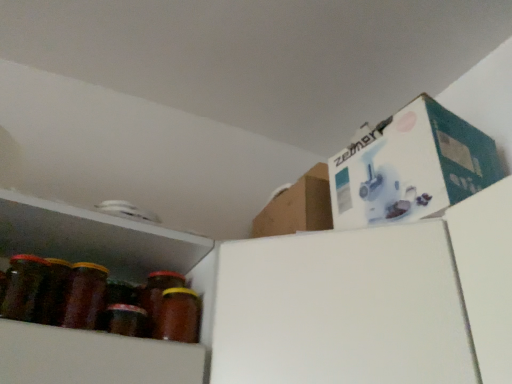
Question: From the image's perspective, is brown glass jar at lower left, the 2th bottle positioned from the left, on top of shiny brown glass jar at left, which is the 2th bottle in right-to-left order?

Choices:
 (A) yes
 (B) no

Answer: (B)

Question: Can you confirm if brown glass jar at lower left, acting as the first bottle starting from the right, is bigger than shiny brown glass jar at left, marked as the 1th bottle in a left-to-right arrangement?

Choices:
 (A) no
 (B) yes

Answer: (A)

Question: Is the depth of brown glass jar at lower left, acting as the first bottle starting from the right, greater than that of shiny brown glass jar at left, marked as the 1th bottle in a left-to-right arrangement?

Choices:
 (A) no
 (B) yes

Answer: (B)

Question: From a real-world perspective, is brown glass jar at lower left, acting as the first bottle starting from the right, beneath shiny brown glass jar at left, marked as the 1th bottle in a left-to-right arrangement?

Choices:
 (A) no
 (B) yes

Answer: (A)

Question: Would you consider brown glass jar at lower left, the 2th bottle positioned from the left, to be distant from shiny brown glass jar at left, which is the 2th bottle in right-to-left order?

Choices:
 (A) no
 (B) yes

Answer: (A)

Question: Is brown glass jar at lower left, acting as the first bottle starting from the right, next to shiny brown glass jar at left, marked as the 1th bottle in a left-to-right arrangement, and touching it?

Choices:
 (A) yes
 (B) no

Answer: (B)

Question: Considering the relative positions of shiny brown glass jar at left, which is the 2th bottle in right-to-left order, and brown glass jar at lower left, the 2th bottle positioned from the left, in the image provided, is shiny brown glass jar at left, which is the 2th bottle in right-to-left order, to the left of brown glass jar at lower left, the 2th bottle positioned from the left, from the viewer's perspective?

Choices:
 (A) no
 (B) yes

Answer: (B)

Question: Can you confirm if shiny brown glass jar at left, marked as the 1th bottle in a left-to-right arrangement, is thinner than brown glass jar at lower left, the 2th bottle positioned from the left?

Choices:
 (A) yes
 (B) no

Answer: (B)

Question: Is shiny brown glass jar at left, marked as the 1th bottle in a left-to-right arrangement, closer to camera compared to brown glass jar at lower left, acting as the first bottle starting from the right?

Choices:
 (A) yes
 (B) no

Answer: (A)

Question: Does shiny brown glass jar at left, which is the 2th bottle in right-to-left order, have a smaller size compared to brown glass jar at lower left, acting as the first bottle starting from the right?

Choices:
 (A) no
 (B) yes

Answer: (A)

Question: Is shiny brown glass jar at left, marked as the 1th bottle in a left-to-right arrangement, further to the viewer compared to brown glass jar at lower left, the 2th bottle positioned from the left?

Choices:
 (A) yes
 (B) no

Answer: (B)

Question: From a real-world perspective, is shiny brown glass jar at left, which is the 2th bottle in right-to-left order, physically above brown glass jar at lower left, the 2th bottle positioned from the left?

Choices:
 (A) yes
 (B) no

Answer: (B)

Question: Visually, is brown glass jar at lower left, the 2th bottle positioned from the left, positioned to the left or to the right of shiny brown glass jar at left, marked as the 1th bottle in a left-to-right arrangement?

Choices:
 (A) right
 (B) left

Answer: (A)